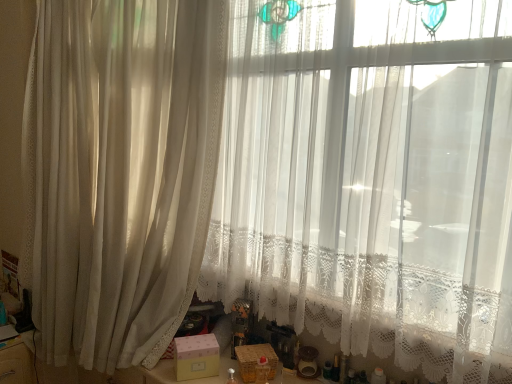
Question: Is pink matte box at center, the first box in the left-to-right sequence, at the right side of sheer white curtain at left?

Choices:
 (A) no
 (B) yes

Answer: (B)

Question: Is there a large distance between pink matte box at center, the 2th box when ordered from right to left, and sheer white curtain at left?

Choices:
 (A) yes
 (B) no

Answer: (B)

Question: Does pink matte box at center, the first box in the left-to-right sequence, lie behind sheer white curtain at left?

Choices:
 (A) no
 (B) yes

Answer: (B)

Question: Can you confirm if pink matte box at center, the first box in the left-to-right sequence, is wider than sheer white curtain at left?

Choices:
 (A) no
 (B) yes

Answer: (A)

Question: From the image's perspective, is pink matte box at center, the 2th box when ordered from right to left, located beneath sheer white curtain at left?

Choices:
 (A) yes
 (B) no

Answer: (A)

Question: Is sheer white curtain at left at the back of pink matte box at center, the first box in the left-to-right sequence?

Choices:
 (A) no
 (B) yes

Answer: (B)

Question: Does sheer white curtain at left have a lesser width compared to wooden basket at lower center, marked as the 2th box in a left-to-right arrangement?

Choices:
 (A) no
 (B) yes

Answer: (A)

Question: Can you confirm if sheer white curtain at left is positioned to the left of wooden basket at lower center, marked as the 2th box in a left-to-right arrangement?

Choices:
 (A) yes
 (B) no

Answer: (A)

Question: From the image's perspective, would you say sheer white curtain at left is positioned over wooden basket at lower center, which appears as the first box when viewed from the right?

Choices:
 (A) yes
 (B) no

Answer: (A)

Question: Can we say sheer white curtain at left lies outside wooden basket at lower center, marked as the 2th box in a left-to-right arrangement?

Choices:
 (A) yes
 (B) no

Answer: (A)

Question: Can you confirm if sheer white curtain at left is shorter than wooden basket at lower center, marked as the 2th box in a left-to-right arrangement?

Choices:
 (A) yes
 (B) no

Answer: (B)

Question: Considering the relative sizes of sheer white curtain at left and wooden basket at lower center, which appears as the first box when viewed from the right, in the image provided, is sheer white curtain at left smaller than wooden basket at lower center, which appears as the first box when viewed from the right,?

Choices:
 (A) yes
 (B) no

Answer: (B)

Question: Are pink matte box at center, the 2th box when ordered from right to left, and wooden basket at lower center, marked as the 2th box in a left-to-right arrangement, far apart?

Choices:
 (A) yes
 (B) no

Answer: (B)